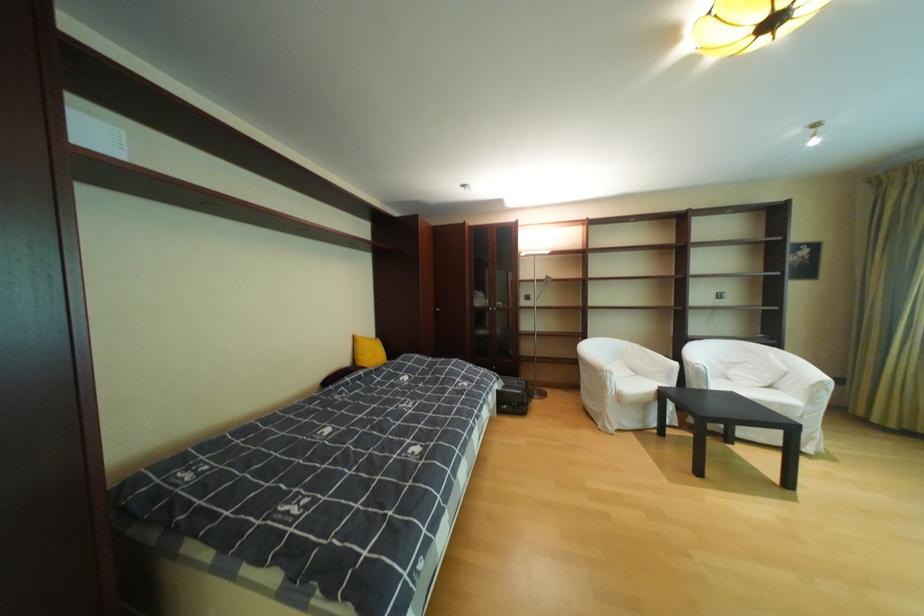
What do you see at coordinates (720, 294) in the screenshot? This screenshot has height=616, width=924. I see `a black wall outlet` at bounding box center [720, 294].